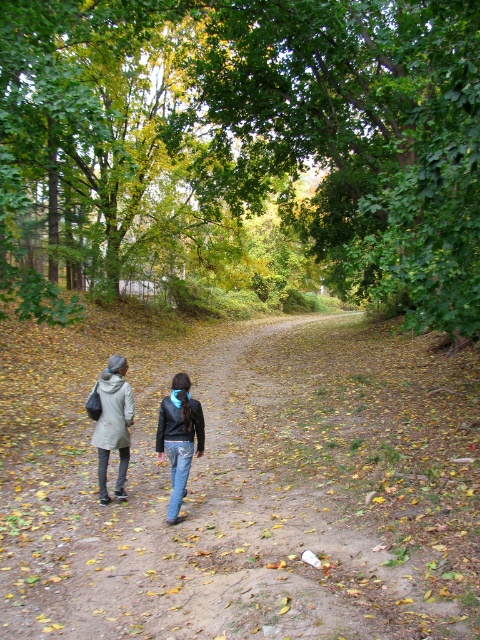
Question: Estimate the real-world distances between objects in this image. Which object is closer to the green leafy tree at center?

Choices:
 (A) gray wool coat at lower left
 (B) denim jacket at center

Answer: (B)

Question: Is brown dirt path at center wider than gray wool coat at lower left?

Choices:
 (A) no
 (B) yes

Answer: (B)

Question: Which object is closer to the camera taking this photo?

Choices:
 (A) denim jacket at center
 (B) green leafy tree at center
 (C) gray wool coat at lower left
 (D) brown dirt path at center

Answer: (D)

Question: Can you confirm if green leafy tree at center is positioned below gray wool coat at lower left?

Choices:
 (A) yes
 (B) no

Answer: (B)

Question: Does brown dirt path at center appear on the left side of light gray coat at center?

Choices:
 (A) yes
 (B) no

Answer: (B)

Question: Based on their relative distances, which object is nearer to the green leafy tree at center?

Choices:
 (A) brown dirt path at center
 (B) denim jacket at center
 (C) gray wool coat at lower left
 (D) light gray coat at center

Answer: (A)